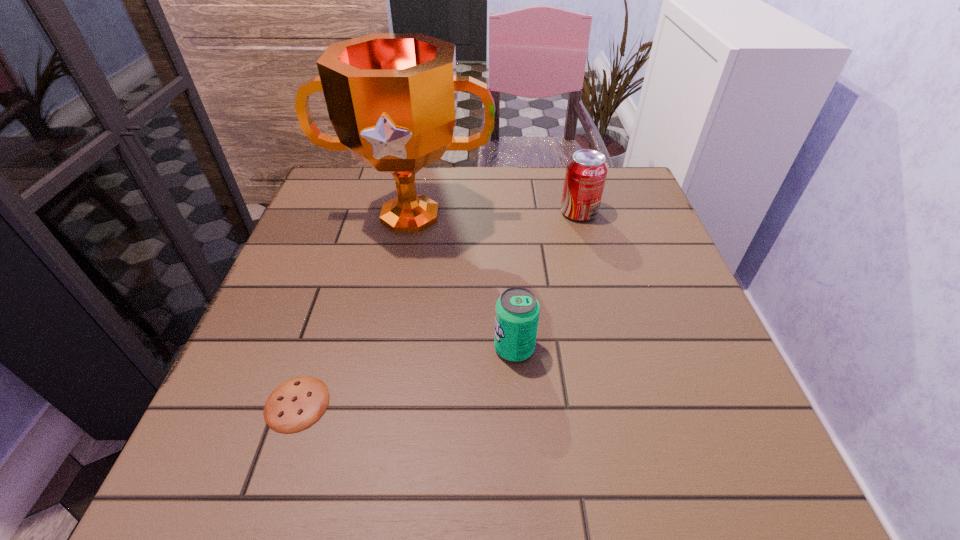
The height and width of the screenshot is (540, 960). Find the location of `vacant region that satisfies the following two spatial constraints: 1. on the back side of the nearest object; 2. on the right side of the rightmost object`. vacant region that satisfies the following two spatial constraints: 1. on the back side of the nearest object; 2. on the right side of the rightmost object is located at coordinates point(360,212).

Locate an element on the screen. vacant position in the image that satisfies the following two spatial constraints: 1. on the front side of the second tallest object; 2. on the front-facing side of the nearer pop soda is located at coordinates (615, 348).